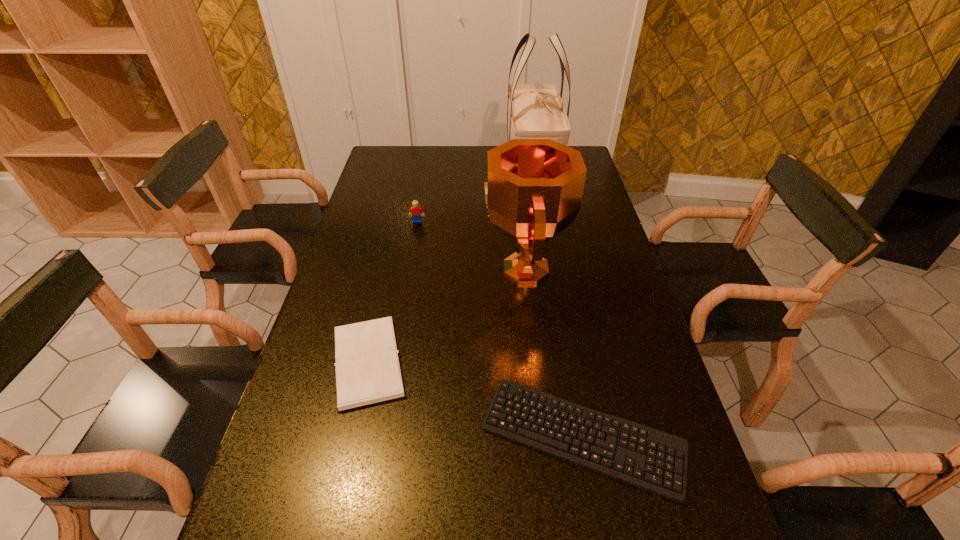
The width and height of the screenshot is (960, 540). What are the coordinates of `the farthest object` in the screenshot? It's located at (534, 111).

The width and height of the screenshot is (960, 540). In order to click on the tallest object in this screenshot , I will do `click(534, 111)`.

Find the location of a particular element. The height and width of the screenshot is (540, 960). award is located at coordinates (534, 188).

Locate an element on the screen. the fourth shortest object is located at coordinates (534, 188).

Locate an element on the screen. the fourth nearest object is located at coordinates (415, 211).

Identify the location of the third shortest object. (415, 211).

At what (x,y) coordinates should I click in order to perform the action: click on hardback book. Please return your answer as a coordinate pair (x, y). Looking at the image, I should click on (368, 370).

Locate an element on the screen. The width and height of the screenshot is (960, 540). computer keyboard is located at coordinates (652, 460).

Where is `blank area located 0.280m with handles facing forward on the farthest object`? blank area located 0.280m with handles facing forward on the farthest object is located at coordinates (544, 252).

At what (x,y) coordinates should I click in order to perform the action: click on vacant area situated 0.270m on the side of the second tallest object with the star emblem. Please return your answer as a coordinate pair (x, y). Looking at the image, I should click on pyautogui.click(x=393, y=269).